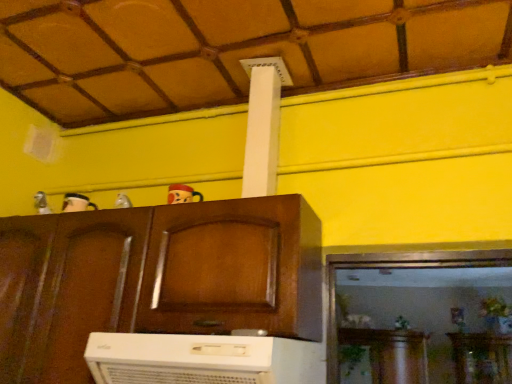
Question: Should I look upward or downward to see matte plastic toy at upper center, marked as the second toy in a left-to-right arrangement?

Choices:
 (A) up
 (B) down

Answer: (B)

Question: Is wooden ceiling at upper center shorter than wooden cabinet at center?

Choices:
 (A) yes
 (B) no

Answer: (A)

Question: Is wooden ceiling at upper center oriented towards wooden cabinet at center?

Choices:
 (A) yes
 (B) no

Answer: (B)

Question: Is wooden ceiling at upper center positioned far away from wooden cabinet at center?

Choices:
 (A) yes
 (B) no

Answer: (B)

Question: From the image's perspective, is wooden ceiling at upper center over wooden cabinet at center?

Choices:
 (A) yes
 (B) no

Answer: (A)

Question: Can you see wooden ceiling at upper center touching wooden cabinet at center?

Choices:
 (A) yes
 (B) no

Answer: (B)

Question: Can you confirm if wooden ceiling at upper center is bigger than wooden cabinet at center?

Choices:
 (A) no
 (B) yes

Answer: (A)

Question: Is wooden cabinet at center facing towards metallic silver toy at upper center, acting as the first toy starting from the left?

Choices:
 (A) no
 (B) yes

Answer: (A)

Question: Can we say wooden cabinet at center lies outside metallic silver toy at upper center, acting as the first toy starting from the left?

Choices:
 (A) no
 (B) yes

Answer: (B)

Question: Does wooden cabinet at center have a greater width compared to metallic silver toy at upper center, which ranks as the second toy in right-to-left order?

Choices:
 (A) no
 (B) yes

Answer: (B)

Question: Does wooden cabinet at center have a smaller size compared to metallic silver toy at upper center, acting as the first toy starting from the left?

Choices:
 (A) yes
 (B) no

Answer: (B)

Question: Is wooden cabinet at center taller than metallic silver toy at upper center, which ranks as the second toy in right-to-left order?

Choices:
 (A) yes
 (B) no

Answer: (A)

Question: From the image's perspective, is wooden cabinet at center located above metallic silver toy at upper center, acting as the first toy starting from the left?

Choices:
 (A) no
 (B) yes

Answer: (A)

Question: From the image's perspective, is matte plastic toy at upper center, marked as the second toy in a left-to-right arrangement, located above metallic silver toy at upper center, acting as the first toy starting from the left?

Choices:
 (A) yes
 (B) no

Answer: (A)